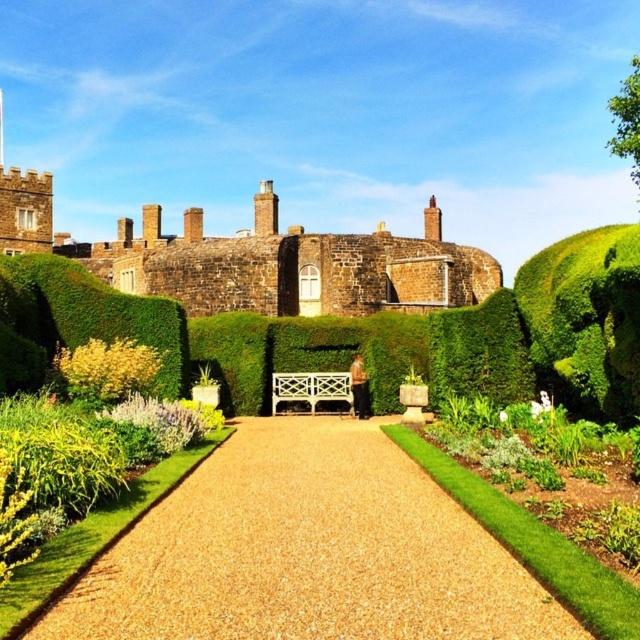
Question: Among these objects, which one is farthest from the camera?

Choices:
 (A) green leafy bush at center
 (B) gravel path at center

Answer: (A)

Question: Which object is closer to the camera taking this photo?

Choices:
 (A) gravel path at center
 (B) green leafy bush at center
 (C) brown stone castle at upper center

Answer: (A)

Question: Is gravel path at center closer to the viewer compared to brown stone castle at upper center?

Choices:
 (A) no
 (B) yes

Answer: (B)

Question: Is brown stone castle at upper center below green leafy bush at center?

Choices:
 (A) no
 (B) yes

Answer: (A)

Question: Which object appears closest to the camera in this image?

Choices:
 (A) green leafy bush at center
 (B) gravel path at center
 (C) brown stone castle at upper center

Answer: (B)

Question: Does gravel path at center lie in front of brown stone castle at upper center?

Choices:
 (A) yes
 (B) no

Answer: (A)